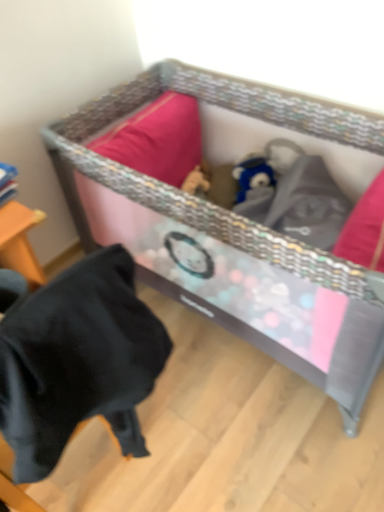
Question: Is textured woven crib at center outside of black fabric at lower left?

Choices:
 (A) no
 (B) yes

Answer: (B)

Question: Does textured woven crib at center lie in front of black fabric at lower left?

Choices:
 (A) yes
 (B) no

Answer: (B)

Question: From a real-world perspective, is textured woven crib at center on black fabric at lower left?

Choices:
 (A) no
 (B) yes

Answer: (A)

Question: Does textured woven crib at center have a smaller size compared to black fabric at lower left?

Choices:
 (A) yes
 (B) no

Answer: (B)

Question: Are textured woven crib at center and black fabric at lower left far apart?

Choices:
 (A) yes
 (B) no

Answer: (B)

Question: Is textured woven crib at center further to the viewer compared to black fabric at lower left?

Choices:
 (A) no
 (B) yes

Answer: (B)

Question: Is black fabric at lower left taller than textured woven crib at center?

Choices:
 (A) no
 (B) yes

Answer: (B)

Question: Is black fabric at lower left thinner than textured woven crib at center?

Choices:
 (A) no
 (B) yes

Answer: (B)

Question: Is black fabric at lower left facing away from textured woven crib at center?

Choices:
 (A) yes
 (B) no

Answer: (B)

Question: Considering the relative sizes of black fabric at lower left and textured woven crib at center in the image provided, is black fabric at lower left wider than textured woven crib at center?

Choices:
 (A) no
 (B) yes

Answer: (A)

Question: From the image's perspective, is black fabric at lower left over textured woven crib at center?

Choices:
 (A) yes
 (B) no

Answer: (B)

Question: Is black fabric at lower left outside of textured woven crib at center?

Choices:
 (A) no
 (B) yes

Answer: (B)

Question: From their relative heights in the image, would you say black fabric at lower left is taller or shorter than textured woven crib at center?

Choices:
 (A) tall
 (B) short

Answer: (A)